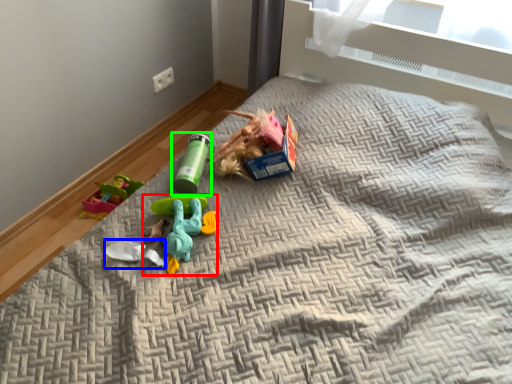
Question: Estimate the real-world distances between objects in this image. Which object is closer to toy (highlighted by a red box), toy (highlighted by a blue box) or toy (highlighted by a green box)?

Choices:
 (A) toy
 (B) toy

Answer: (A)